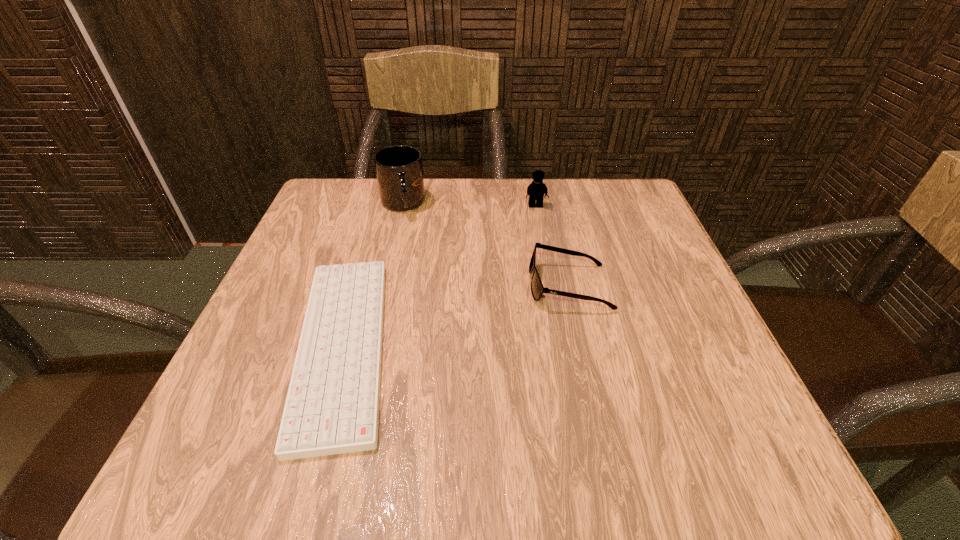
This screenshot has height=540, width=960. Identify the location of the tallest object. (399, 171).

Find the location of a particular element. the third shortest object is located at coordinates [x=537, y=189].

Where is `sunglasses`? The width and height of the screenshot is (960, 540). sunglasses is located at coordinates (537, 289).

The image size is (960, 540). Find the location of `the shortest object`. the shortest object is located at coordinates (332, 407).

Where is `vacant area situated with the handle on the side of the mug`? This screenshot has width=960, height=540. vacant area situated with the handle on the side of the mug is located at coordinates (386, 276).

The image size is (960, 540). I want to click on vacant space located 0.070m on the front-facing side of the Lego, so click(x=540, y=229).

You are a GUI agent. You are given a task and a screenshot of the screen. Output one action in this format:
    pyautogui.click(x=<x>, y=<y>)
    Task: Click on the vacant space located 0.060m on the front-facing side of the sunglasses
    The image size is (960, 540).
    Given the screenshot: What is the action you would take?
    pyautogui.click(x=496, y=286)

This screenshot has width=960, height=540. What are the coordinates of `free space located on the front-facing side of the sunglasses` in the screenshot? It's located at (387, 286).

You are a GUI agent. You are given a task and a screenshot of the screen. Output one action in this format:
    pyautogui.click(x=<x>, y=<y>)
    Task: Click on the vacant space located 0.250m on the front-facing side of the sunglasses
    
    Given the screenshot: What is the action you would take?
    pyautogui.click(x=393, y=286)

Locate an element on the screen. This screenshot has height=540, width=960. free spot located 0.140m on the right of the shortest object is located at coordinates (484, 346).